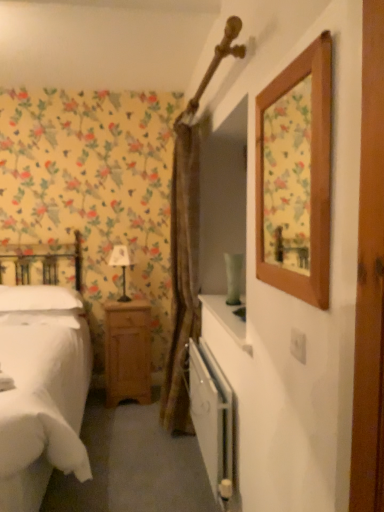
What do you see at coordinates (127, 352) in the screenshot? The image size is (384, 512). I see `light brown wood nightstand at lower left` at bounding box center [127, 352].

Measure the distance between brown textured curtain at center and camera.

A distance of 2.40 meters exists between brown textured curtain at center and camera.

Find the location of a particular element. This screenshot has width=384, height=512. white metallic radiator at lower center is located at coordinates (212, 419).

The width and height of the screenshot is (384, 512). What do you see at coordinates (121, 266) in the screenshot?
I see `white fabric-covered table lamp at center-left` at bounding box center [121, 266].

Identify the location of white fabric-covered table lamp at center-left. pyautogui.click(x=121, y=266).

You are a GUI agent. You are given a task and a screenshot of the screen. Output one action in this format:
    pyautogui.click(x=<x>, y=<y>)
    Task: Click on the wooden picture frame at upper right
    The height and width of the screenshot is (512, 384).
    Given the screenshot: What is the action you would take?
    pyautogui.click(x=296, y=177)

I want to click on light brown wood nightstand at lower left, so click(127, 352).

Is white metallic radiator at lower center positioned behind light brown wood nightstand at lower left?

No, it is not.

At what (x,y) coordinates should I click in order to perform the action: click on nightstand that is under the white metallic radiator at lower center (from a real-world perspective). Please return your answer as a coordinate pair (x, y). This screenshot has height=512, width=384. Looking at the image, I should click on (127, 352).

Does white metallic radiator at lower center contain light brown wood nightstand at lower left?

No, light brown wood nightstand at lower left is not a part of white metallic radiator at lower center.

Do you think white soft pillow at left is within brown textured curtain at center, or outside of it?

The correct answer is: outside.

From the image's perspective, who appears lower, white soft pillow at left or brown textured curtain at center?

white soft pillow at left.

Is white soft pillow at left directly adjacent to brown textured curtain at center?

No, white soft pillow at left is not next to brown textured curtain at center.

Considering the relative sizes of white soft pillow at left and brown textured curtain at center in the image provided, is white soft pillow at left smaller than brown textured curtain at center?

Yes.

Between brown textured curtain at center and white matte bed at left, which one is positioned in front?

Positioned in front is white matte bed at left.

From a real-world perspective, is brown textured curtain at center positioned above or below white matte bed at left?

From a real-world perspective, brown textured curtain at center is physically above white matte bed at left.

Is brown textured curtain at center positioned far away from white matte bed at left?

No, brown textured curtain at center is not far from white matte bed at left.

Is white soft pillow at left facing towards white metallic radiator at lower center?

No, white soft pillow at left is not oriented towards white metallic radiator at lower center.

Considering the positions of point (72, 292) and point (192, 342), is point (72, 292) closer or farther from the camera than point (192, 342)?

Point (72, 292) is farther from the camera than point (192, 342).

From the picture: Is white soft pillow at left completely or partially outside of white metallic radiator at lower center?

Yes, white soft pillow at left is not within white metallic radiator at lower center.

Is white fabric-covered table lamp at center-left beside brown textured curtain at center?

No, white fabric-covered table lamp at center-left is not making contact with brown textured curtain at center.

Is white fabric-covered table lamp at center-left smaller than brown textured curtain at center?

Indeed, white fabric-covered table lamp at center-left has a smaller size compared to brown textured curtain at center.

Is white fabric-covered table lamp at center-left facing away from brown textured curtain at center?

white fabric-covered table lamp at center-left is not turned away from brown textured curtain at center.

Is white fabric-covered table lamp at center-left not within brown textured curtain at center?

Yes, white fabric-covered table lamp at center-left is not within brown textured curtain at center.

Looking at this image, considering the positions of objects brown textured curtain at center and wooden picture frame at upper right in the image provided, who is more to the left, brown textured curtain at center or wooden picture frame at upper right?

From the viewer's perspective, brown textured curtain at center appears more on the left side.

From a real-world perspective, which object stands above the other?

wooden picture frame at upper right is physically above.

Locate an element on the screen. picture frame that is above the brown textured curtain at center (from a real-world perspective) is located at coordinates (296, 177).

Consider the image. Is brown textured curtain at center oriented away from wooden picture frame at upper right?

No, brown textured curtain at center is not facing away from wooden picture frame at upper right.

Which object is positioned more to the right, wooden picture frame at upper right or white soft pillow at left?

From the viewer's perspective, wooden picture frame at upper right appears more on the right side.

Between wooden picture frame at upper right and white soft pillow at left, which one has larger width?

white soft pillow at left is wider.

Consider the image. Could you tell me if wooden picture frame at upper right is turned towards white soft pillow at left?

No, wooden picture frame at upper right does not turn towards white soft pillow at left.

Where is `pillow below the wooden picture frame at upper right (from a real-world perspective)`? The width and height of the screenshot is (384, 512). pillow below the wooden picture frame at upper right (from a real-world perspective) is located at coordinates (38, 298).

Where is `radiator above the light brown wood nightstand at lower left (from a real-world perspective)`? The width and height of the screenshot is (384, 512). radiator above the light brown wood nightstand at lower left (from a real-world perspective) is located at coordinates (212, 419).

This screenshot has width=384, height=512. Identify the location of curtain in front of the white soft pillow at left. (182, 272).

From the image, which object appears to be farther from brown textured curtain at center, wooden picture frame at upper right or light brown wood nightstand at lower left?

wooden picture frame at upper right is further to brown textured curtain at center.

Estimate the real-world distances between objects in this image. Which object is further from wooden picture frame at upper right, light brown wood nightstand at lower left or white fabric-covered table lamp at center-left?

Among the two, white fabric-covered table lamp at center-left is located further to wooden picture frame at upper right.

In the scene shown: From the image, which object appears to be farther from white metallic radiator at lower center, wooden picture frame at upper right or brown textured curtain at center?

wooden picture frame at upper right is positioned further to the anchor white metallic radiator at lower center.

From the image, which object appears to be farther from light brown wood nightstand at lower left, brown textured curtain at center or white fabric-covered table lamp at center-left?

Based on the image, brown textured curtain at center appears to be further to light brown wood nightstand at lower left.

When comparing their distances from brown textured curtain at center, does white soft pillow at left or white matte bed at left seem closer?

white matte bed at left lies closer to brown textured curtain at center than the other object.

Considering their positions, is light brown wood nightstand at lower left positioned closer to white matte bed at left than white metallic radiator at lower center?

light brown wood nightstand at lower left.

Which object lies nearer to the anchor point brown textured curtain at center, white fabric-covered table lamp at center-left or white metallic radiator at lower center?

white metallic radiator at lower center is positioned closer to the anchor brown textured curtain at center.

Considering their positions, is light brown wood nightstand at lower left positioned further to brown textured curtain at center than white matte bed at left?

Based on the image, white matte bed at left appears to be further to brown textured curtain at center.

Where is `table lamp between white soft pillow at left and brown textured curtain at center`? The height and width of the screenshot is (512, 384). table lamp between white soft pillow at left and brown textured curtain at center is located at coordinates (121, 266).

Image resolution: width=384 pixels, height=512 pixels. What are the coordinates of `radiator between white matte bed at left and white soft pillow at left from front to back` in the screenshot? It's located at (212, 419).

Image resolution: width=384 pixels, height=512 pixels. Find the location of `curtain between white metallic radiator at lower center and white fabric-covered table lamp at center-left from front to back`. curtain between white metallic radiator at lower center and white fabric-covered table lamp at center-left from front to back is located at coordinates (182, 272).

Find the location of a particular element. pillow between wooden picture frame at upper right and white fabric-covered table lamp at center-left from front to back is located at coordinates (38, 298).